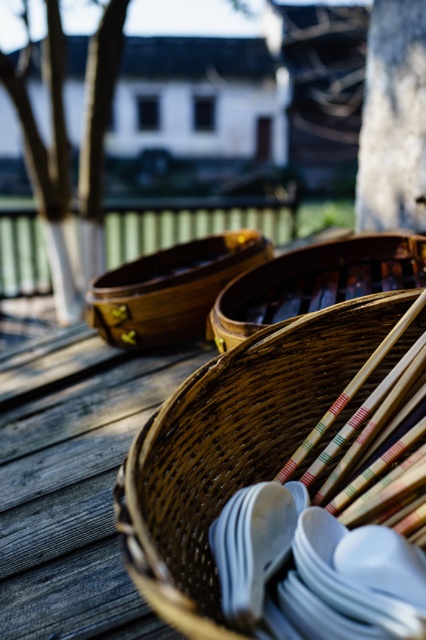
You are an artist planning to sketch the scene. You need to decide which object to draw first based on their sizes. Which one should you start with, the gray rough bark at upper right or the brown woven basket at center?

The gray rough bark at upper right is smaller than the brown woven basket at center, so you should start with the brown woven basket at center as it is larger and might require more detailed work first.

You are an artist trying to sketch this scene. You want to ensure the proportions are accurate. Which object between the gray rough bark at upper right and the wooden chopsticks at center should you draw taller?

The gray rough bark at upper right is taller than the wooden chopsticks at center, so you should draw the gray rough bark at upper right taller.